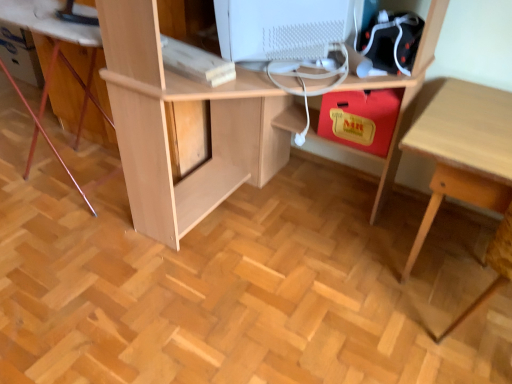
Locate an element on the screen. vacant space that's between light wood table at lower right and light wood desk at center is located at coordinates (372, 310).